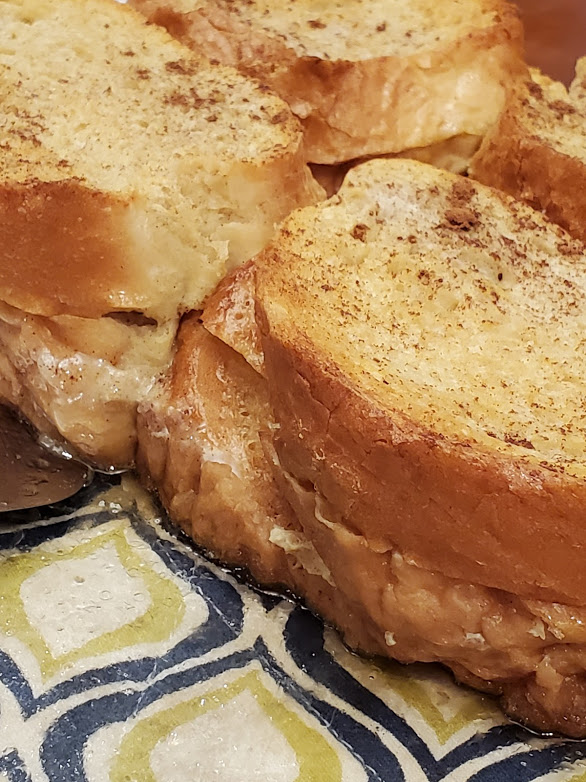
Identify the location of floor. Image resolution: width=586 pixels, height=782 pixels. (224, 744).